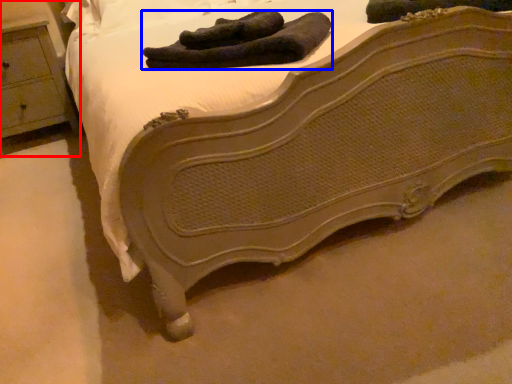
Question: Among these objects, which one is farthest to the camera, nightstand (highlighted by a red box) or footwear (highlighted by a blue box)?

Choices:
 (A) nightstand
 (B) footwear

Answer: (A)